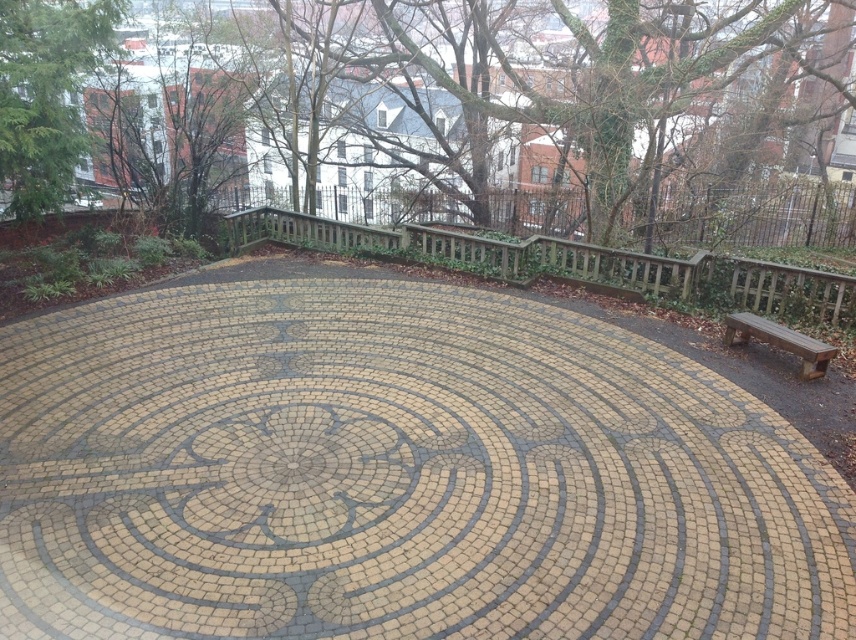
This screenshot has width=856, height=640. Describe the element at coordinates (569, 262) in the screenshot. I see `wooden at center` at that location.

You are a GUI agent. You are given a task and a screenshot of the screen. Output one action in this format:
    pyautogui.click(x=<x>, y=<y>)
    Task: Click on the wooden at center
    Image resolution: width=856 pixels, height=640 pixels.
    Given the screenshot: What is the action you would take?
    pyautogui.click(x=569, y=262)